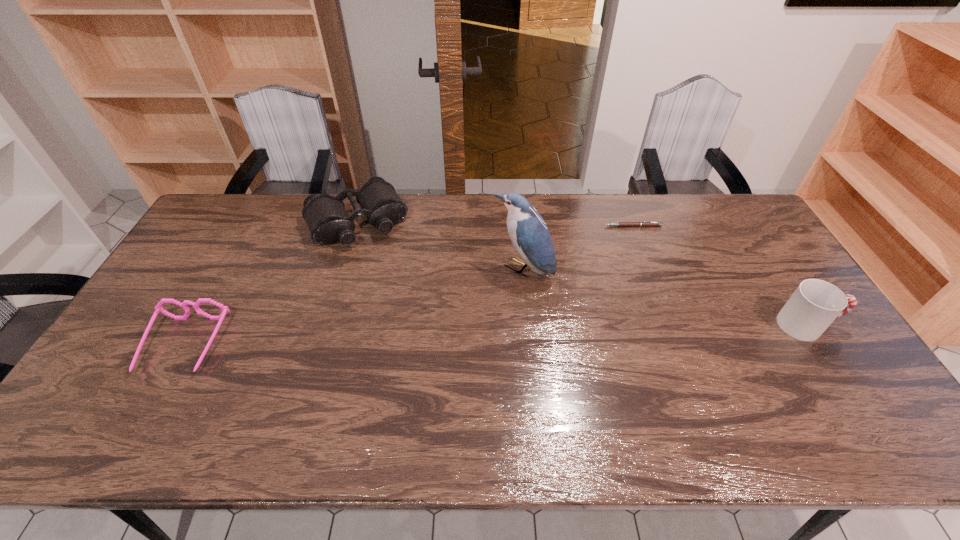
Where is `vacant space situated at the tip of the bird's beak`? vacant space situated at the tip of the bird's beak is located at coordinates coord(465,326).

Find the location of a particular element. vacant position located 0.090m at the tip of the bird's beak is located at coordinates pos(488,302).

The height and width of the screenshot is (540, 960). I want to click on free space located 0.110m at the nib of the shortest object, so click(606, 246).

Locate an element on the screen. The width and height of the screenshot is (960, 540). free space located 0.070m at the nib of the shortest object is located at coordinates (611, 239).

You are a GUI agent. You are given a task and a screenshot of the screen. Output one action in this format:
    pyautogui.click(x=<x>, y=<y>)
    Task: Click on the vacant region located 0.220m at the nib of the shortest object
    The image size is (960, 540).
    Given the screenshot: What is the action you would take?
    pyautogui.click(x=593, y=265)

Locate an element on the screen. The height and width of the screenshot is (540, 960). free space located through the eyepieces of the binoculars is located at coordinates (394, 282).

At what (x,y) coordinates should I click in order to perform the action: click on free space located through the eyepieces of the binoculars. Please return your answer as a coordinate pair (x, y). Looking at the image, I should click on (416, 323).

Find the location of a particular element. This screenshot has height=540, width=960. free point located 0.230m through the eyepieces of the binoculars is located at coordinates (400, 295).

The width and height of the screenshot is (960, 540). I want to click on pen present at the far edge, so tap(620, 224).

Where is `binoculars that is positioned at the far edge`? binoculars that is positioned at the far edge is located at coordinates (328, 221).